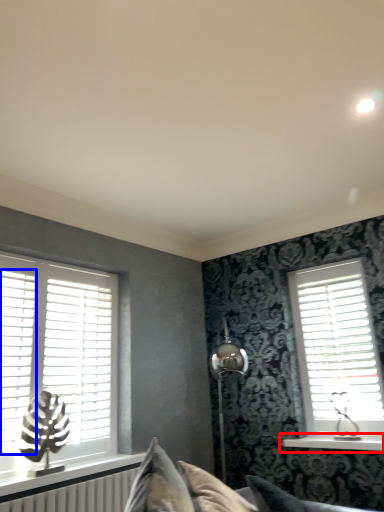
Question: Which object is closer to the camera taking this photo, window sill (highlighted by a red box) or shutter (highlighted by a blue box)?

Choices:
 (A) window sill
 (B) shutter

Answer: (B)